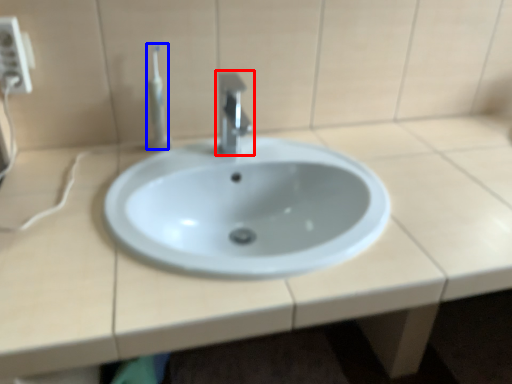
Question: Among these objects, which one is nearest to the camera, tap (highlighted by a red box) or toothbrush (highlighted by a blue box)?

Choices:
 (A) tap
 (B) toothbrush

Answer: (A)